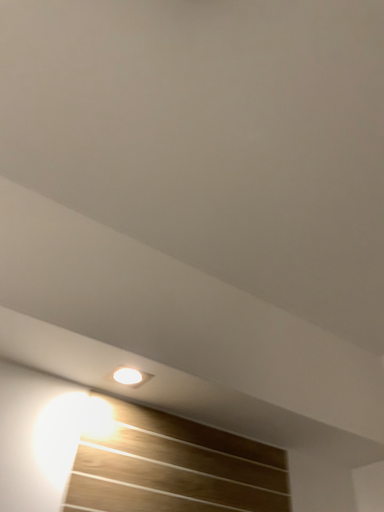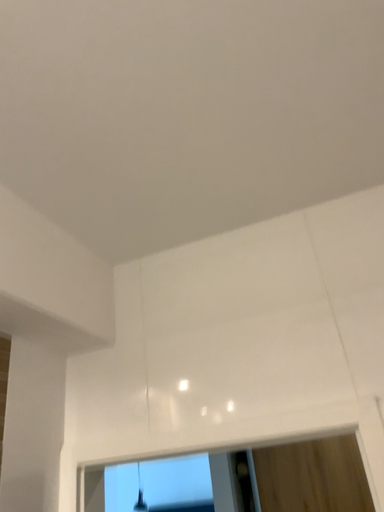
Question: Which way did the camera rotate in the video?

Choices:
 (A) rotated upward
 (B) rotated downward

Answer: (B)